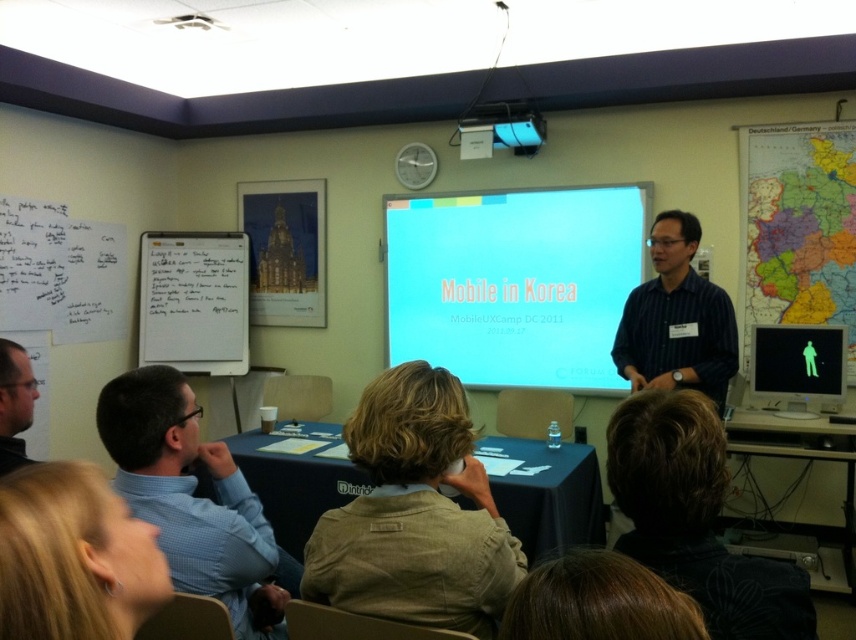
Which of these two, whiteboard at left or green matte screen at center, stands taller?

whiteboard at left

Does whiteboard at left have a lesser height compared to green matte screen at center?

No, whiteboard at left is not shorter than green matte screen at center.

Is point (227, 250) positioned before point (768, 371)?

No, (227, 250) is further to viewer.

This screenshot has width=856, height=640. I want to click on whiteboard at left, so (194, 301).

Is point (836, 330) positioned after point (27, 461)?

Yes.

Between green matte screen at center and matte black shirt at lower left, which one is positioned higher?

green matte screen at center is higher up.

Which is in front, point (840, 346) or point (30, 388)?

Positioned in front is point (30, 388).

The height and width of the screenshot is (640, 856). I want to click on green matte screen at center, so click(797, 360).

Which is below, brown cotton shirt at center or whiteboard at left?

brown cotton shirt at center

Is the position of brown cotton shirt at center less distant than that of whiteboard at left?

Yes, brown cotton shirt at center is closer to the viewer.

Who is more forward, (426, 404) or (171, 342)?

Positioned in front is point (426, 404).

The image size is (856, 640). What are the coordinates of `brown cotton shirt at center` in the screenshot? It's located at (414, 515).